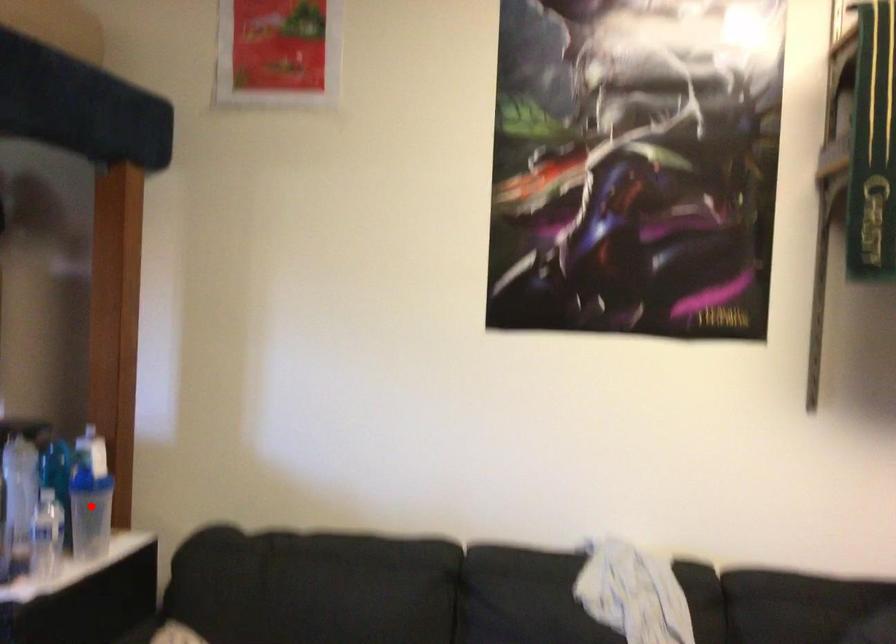
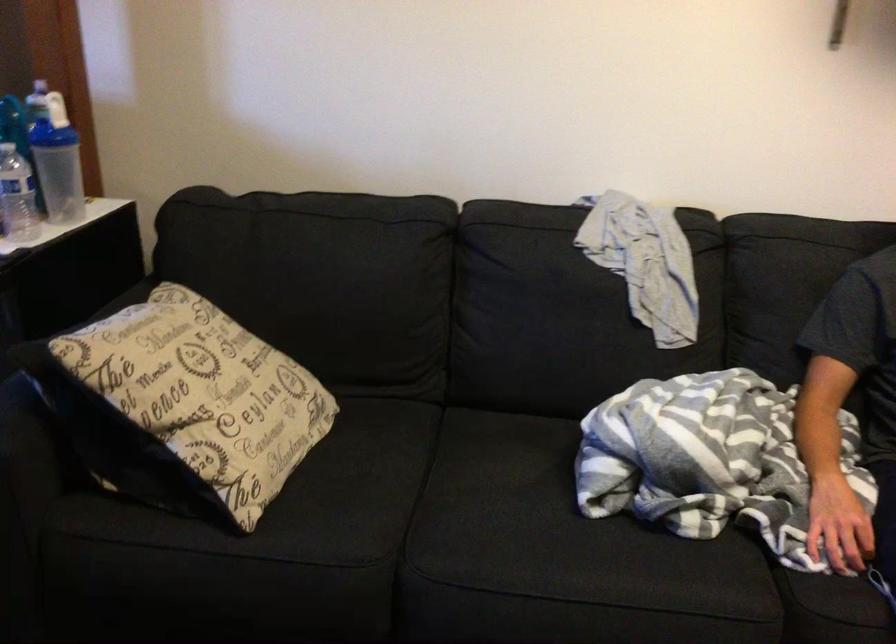
Locate, in the second image, the point that corresponds to the highlighted location in the first image.

(56, 161)